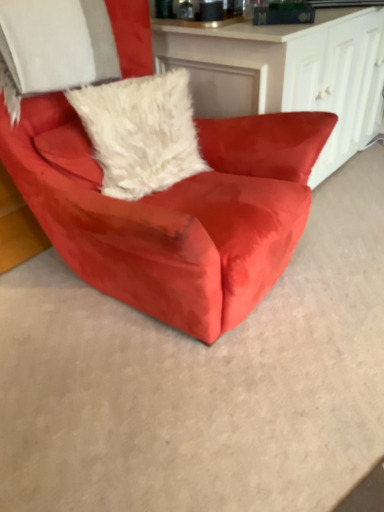
Question: Could you tell me if suede red armchair at center is facing white fluffy pillow at center?

Choices:
 (A) yes
 (B) no

Answer: (A)

Question: Would you consider suede red armchair at center to be distant from white fluffy pillow at center?

Choices:
 (A) yes
 (B) no

Answer: (B)

Question: Considering the relative positions of suede red armchair at center and white fluffy pillow at center in the image provided, is suede red armchair at center to the right of white fluffy pillow at center from the viewer's perspective?

Choices:
 (A) no
 (B) yes

Answer: (B)

Question: Is suede red armchair at center further to camera compared to white fluffy pillow at center?

Choices:
 (A) yes
 (B) no

Answer: (B)

Question: From the image's perspective, is suede red armchair at center located beneath white fluffy pillow at center?

Choices:
 (A) yes
 (B) no

Answer: (A)

Question: Can you confirm if suede red armchair at center is positioned to the left of white fluffy pillow at center?

Choices:
 (A) no
 (B) yes

Answer: (A)

Question: Is white fluffy pillow at center smaller than suede red armchair at center?

Choices:
 (A) no
 (B) yes

Answer: (B)

Question: Is white fluffy pillow at center oriented towards suede red armchair at center?

Choices:
 (A) no
 (B) yes

Answer: (B)

Question: Is white fluffy pillow at center beside suede red armchair at center?

Choices:
 (A) yes
 (B) no

Answer: (B)

Question: Would you say white fluffy pillow at center is a long distance from suede red armchair at center?

Choices:
 (A) no
 (B) yes

Answer: (A)

Question: Is white fluffy pillow at center looking in the opposite direction of suede red armchair at center?

Choices:
 (A) yes
 (B) no

Answer: (A)

Question: Does white fluffy pillow at center lie in front of suede red armchair at center?

Choices:
 (A) no
 (B) yes

Answer: (A)

Question: Would you say suede red armchair at center is inside or outside white fluffy pillow at center?

Choices:
 (A) outside
 (B) inside

Answer: (A)